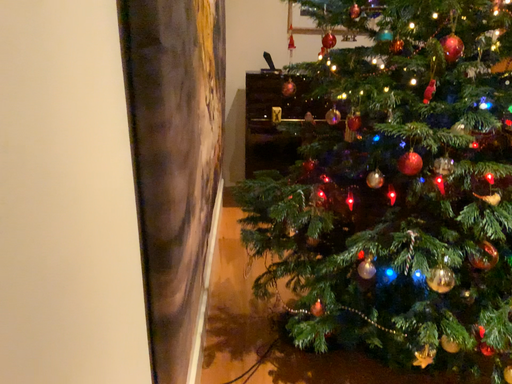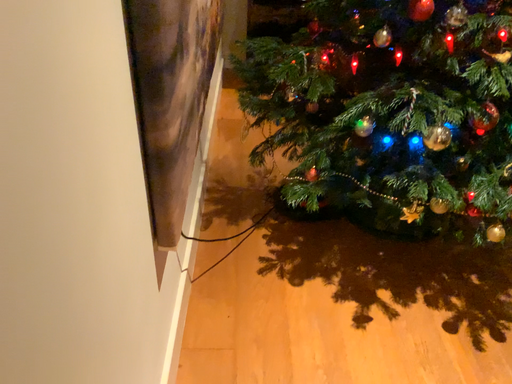
Question: Which way did the camera rotate in the video?

Choices:
 (A) rotated downward
 (B) rotated upward

Answer: (A)